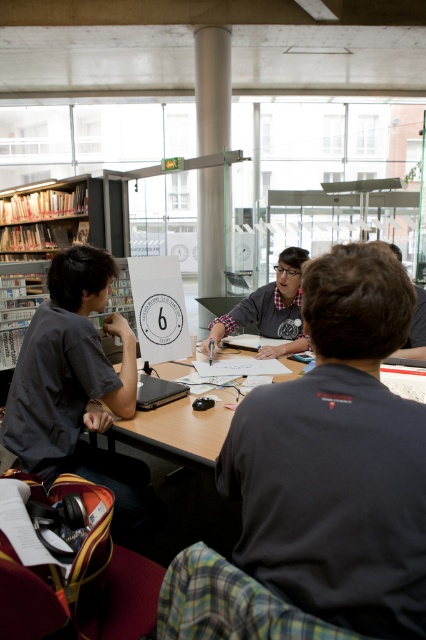
Locate an element on the screen. wooden bookshelf at left is located at coordinates (43, 244).

Can you confirm if wooden bookshelf at left is bigger than satin silver pole at center?

Indeed, wooden bookshelf at left has a larger size compared to satin silver pole at center.

Is point (100, 244) positioned after point (230, 42)?

No, it is in front of (230, 42).

This screenshot has width=426, height=640. Find the location of `wooden bookshelf at left`. wooden bookshelf at left is located at coordinates (43, 244).

Does wooden bookshelf at left have a smaller size compared to matte gray shirt at center?

Actually, wooden bookshelf at left might be larger than matte gray shirt at center.

Which is in front, point (37, 228) or point (275, 330)?

Point (275, 330) is in front.

The image size is (426, 640). What are the coordinates of `wooden bookshelf at left` in the screenshot? It's located at (43, 244).

Is dark gray shirt at center taller than satin silver pole at center?

No.

Who is more distant from viewer, (x=391, y=545) or (x=224, y=237)?

Positioned behind is point (x=224, y=237).

Where is `dark gray shirt at center`? Image resolution: width=426 pixels, height=640 pixels. dark gray shirt at center is located at coordinates (337, 458).